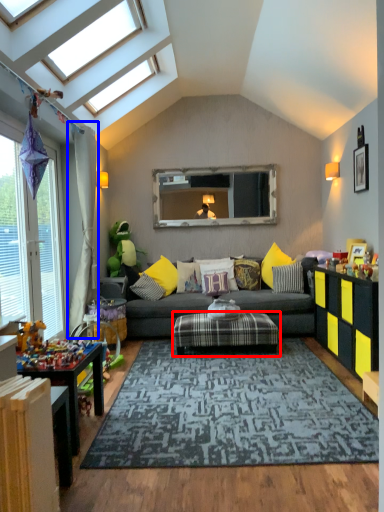
Question: Which object appears farthest to the camera in this image, coffee table (highlighted by a red box) or curtain (highlighted by a blue box)?

Choices:
 (A) coffee table
 (B) curtain

Answer: (B)